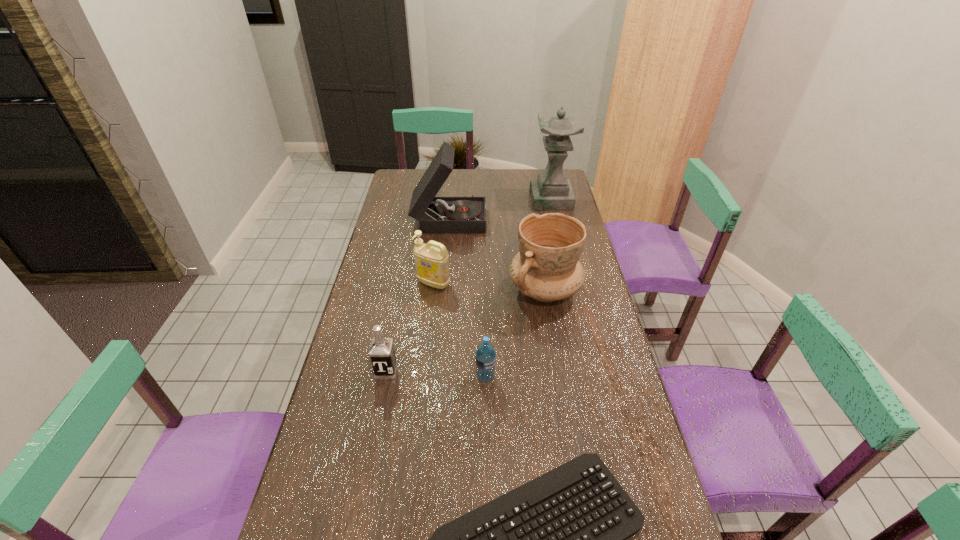
Image resolution: width=960 pixels, height=540 pixels. Find the location of `object that is the fourth nearest to the computer keyboard`. object that is the fourth nearest to the computer keyboard is located at coordinates (431, 260).

Find the location of a particular element. The height and width of the screenshot is (540, 960). object that is the fourth closest one to the pottery is located at coordinates (381, 352).

The width and height of the screenshot is (960, 540). Identify the location of vacant space that satisfies the following two spatial constraints: 1. on the front-facing side of the phonograph_record; 2. on the front label of the vodka. pos(435,371).

Where is `free space that satisfies the following two spatial constraints: 1. on the front-facing side of the phonograph_record; 2. on the left side of the water bottle`? This screenshot has width=960, height=540. free space that satisfies the following two spatial constraints: 1. on the front-facing side of the phonograph_record; 2. on the left side of the water bottle is located at coordinates (435, 377).